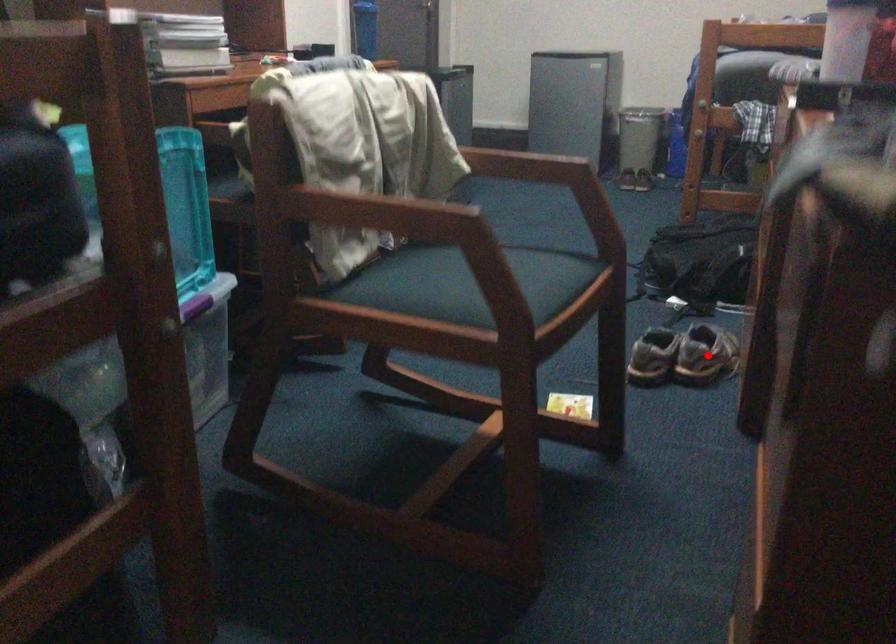
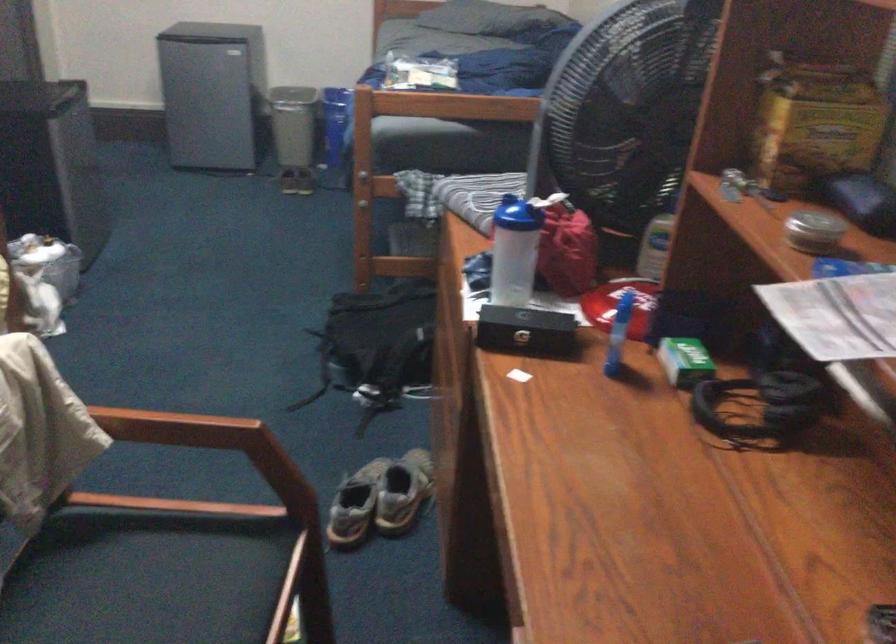
Where in the second image is the point corresponding to the highlighted location from the first image?

(402, 491)